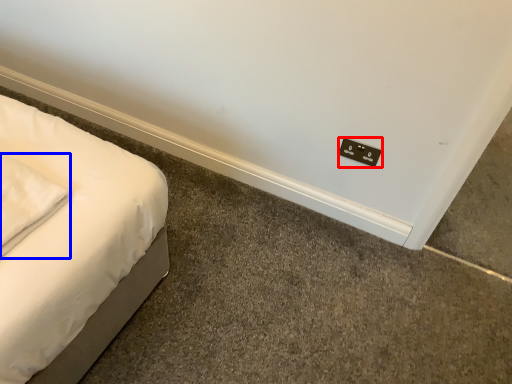
Question: Which of the following is the farthest to the observer, electric outlet (highlighted by a red box) or pillow (highlighted by a blue box)?

Choices:
 (A) electric outlet
 (B) pillow

Answer: (A)